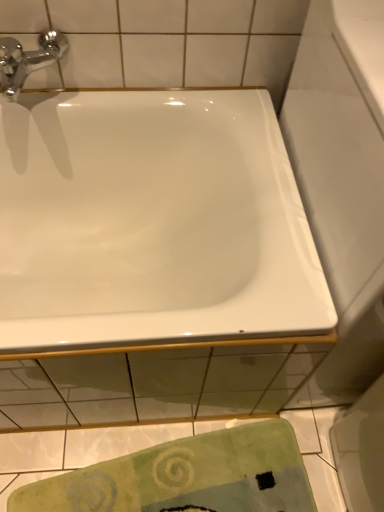
Where is `vacant area on top of green textured towel at lower center (from a real-world perspective)`? This screenshot has width=384, height=512. vacant area on top of green textured towel at lower center (from a real-world perspective) is located at coordinates (156, 469).